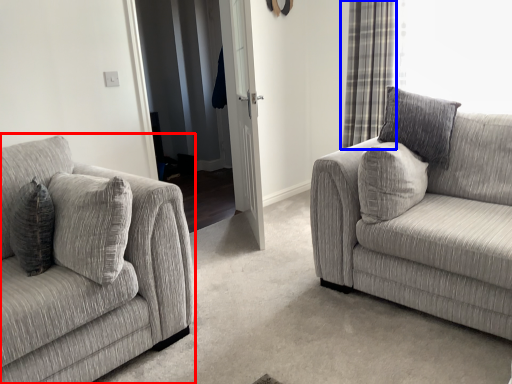
Question: Which object appears closest to the camera in this image, studio couch (highlighted by a red box) or curtain (highlighted by a blue box)?

Choices:
 (A) studio couch
 (B) curtain

Answer: (A)